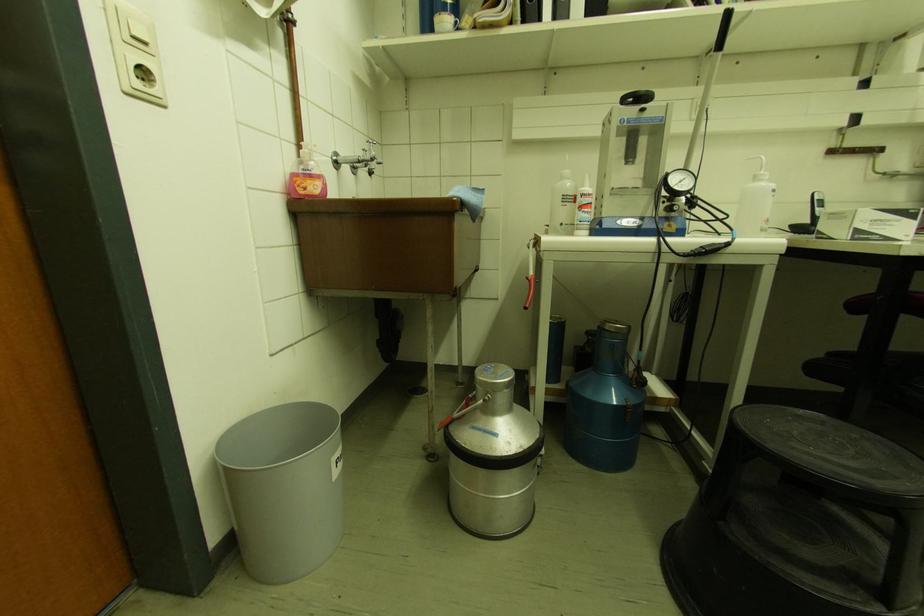
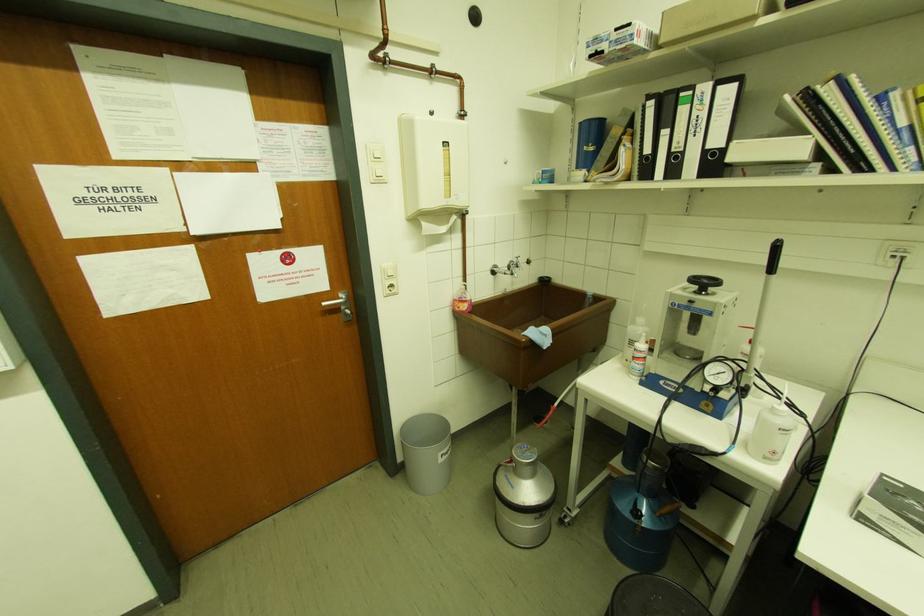
The point at (341,455) is marked in the first image. Where is the corresponding point in the second image?

(446, 453)